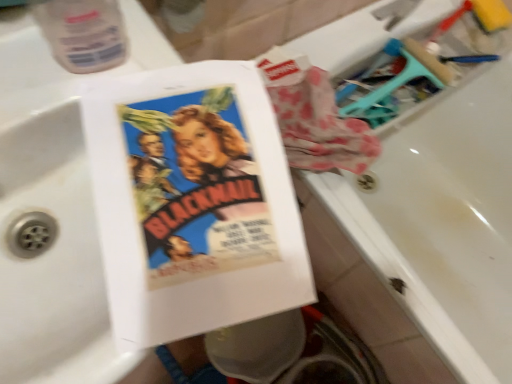
I want to click on white glossy bathtub at upper right, so click(x=443, y=220).

In order to face transparent plastic bottle at upper left, should I rotate leftwards or rightwards?

You should rotate left by 23.165 degrees.

Find the location of `matte paper book at center`. matte paper book at center is located at coordinates (193, 202).

Is transparent plastic bottle at upper left beside matte paper book at center?

No, transparent plastic bottle at upper left is not touching matte paper book at center.

Image resolution: width=512 pixels, height=384 pixels. Identify the location of paperback book in front of the transparent plastic bottle at upper left. (193, 202).

Does transparent plastic bottle at upper left have a lesser height compared to matte paper book at center?

Correct, transparent plastic bottle at upper left is not as tall as matte paper book at center.

From the image's perspective, is transparent plastic bottle at upper left positioned above or below matte paper book at center?

Based on their image positions, transparent plastic bottle at upper left is located above matte paper book at center.

Choose the correct answer: Is matte paper book at center inside white glossy bathtub at upper right or outside it?

matte paper book at center cannot be found inside white glossy bathtub at upper right.

Does matte paper book at center turn towards white glossy bathtub at upper right?

No.

Does matte paper book at center have a greater width compared to white glossy bathtub at upper right?

In fact, matte paper book at center might be narrower than white glossy bathtub at upper right.

Which object is further away from the camera taking this photo, matte paper book at center or white glossy bathtub at upper right?

Positioned behind is white glossy bathtub at upper right.

Could you tell me if transparent plastic bottle at upper left is turned towards white glossy bathtub at upper right?

No, transparent plastic bottle at upper left is not turned towards white glossy bathtub at upper right.

From a real-world perspective, is transparent plastic bottle at upper left positioned above or below white glossy bathtub at upper right?

transparent plastic bottle at upper left is situated higher than white glossy bathtub at upper right in the real world.

Considering the sizes of objects transparent plastic bottle at upper left and white glossy bathtub at upper right in the image provided, who is bigger, transparent plastic bottle at upper left or white glossy bathtub at upper right?

white glossy bathtub at upper right.

Which object is wider, transparent plastic bottle at upper left or white glossy bathtub at upper right?

Wider between the two is white glossy bathtub at upper right.

Does white glossy bathtub at upper right come in front of matte paper book at center?

No, white glossy bathtub at upper right is further to the viewer.

Measure the distance between white glossy bathtub at upper right and matte paper book at center.

white glossy bathtub at upper right and matte paper book at center are 34.44 inches apart.

Could you tell me if white glossy bathtub at upper right is facing matte paper book at center?

No, white glossy bathtub at upper right is not turned towards matte paper book at center.

Considering the sizes of objects white glossy bathtub at upper right and matte paper book at center in the image provided, who is taller, white glossy bathtub at upper right or matte paper book at center?

With more height is white glossy bathtub at upper right.

From the image's perspective, would you say matte paper book at center is positioned over transparent plastic bottle at upper left?

Incorrect, from the image's perspective, matte paper book at center is lower than transparent plastic bottle at upper left.

In the scene shown: Are matte paper book at center and transparent plastic bottle at upper left far apart?

Actually, matte paper book at center and transparent plastic bottle at upper left are a little close together.

Based on the photo, between matte paper book at center and transparent plastic bottle at upper left, which one has larger width?

matte paper book at center.

Who is more distant, white glossy bathtub at upper right or transparent plastic bottle at upper left?

white glossy bathtub at upper right is more distant.

Is white glossy bathtub at upper right placed right next to transparent plastic bottle at upper left?

No, white glossy bathtub at upper right is not in contact with transparent plastic bottle at upper left.

How much distance is there between white glossy bathtub at upper right and transparent plastic bottle at upper left?

3.34 feet.

Identify the location of paperback book located in front of the transparent plastic bottle at upper left. (193, 202).

This screenshot has height=384, width=512. I want to click on bath on the right of matte paper book at center, so click(443, 220).

Estimate the real-world distances between objects in this image. Which object is closer to matte paper book at center, transparent plastic bottle at upper left or white glossy bathtub at upper right?

Among the two, transparent plastic bottle at upper left is located nearer to matte paper book at center.

Which object lies nearer to the anchor point transparent plastic bottle at upper left, matte paper book at center or white glossy bathtub at upper right?

matte paper book at center lies closer to transparent plastic bottle at upper left than the other object.

Estimate the real-world distances between objects in this image. Which object is closer to white glossy bathtub at upper right, transparent plastic bottle at upper left or matte paper book at center?

Among the two, matte paper book at center is located nearer to white glossy bathtub at upper right.

Considering their positions, is white glossy bathtub at upper right positioned closer to transparent plastic bottle at upper left than matte paper book at center?

Based on the image, matte paper book at center appears to be nearer to transparent plastic bottle at upper left.

Looking at the image, which one is located closer to white glossy bathtub at upper right, matte paper book at center or transparent plastic bottle at upper left?

matte paper book at center is closer to white glossy bathtub at upper right.

From the image, which object appears to be nearer to matte paper book at center, white glossy bathtub at upper right or transparent plastic bottle at upper left?

Among the two, transparent plastic bottle at upper left is located nearer to matte paper book at center.

Identify the location of bottle located between matte paper book at center and white glossy bathtub at upper right in the left-right direction. This screenshot has width=512, height=384. (83, 33).